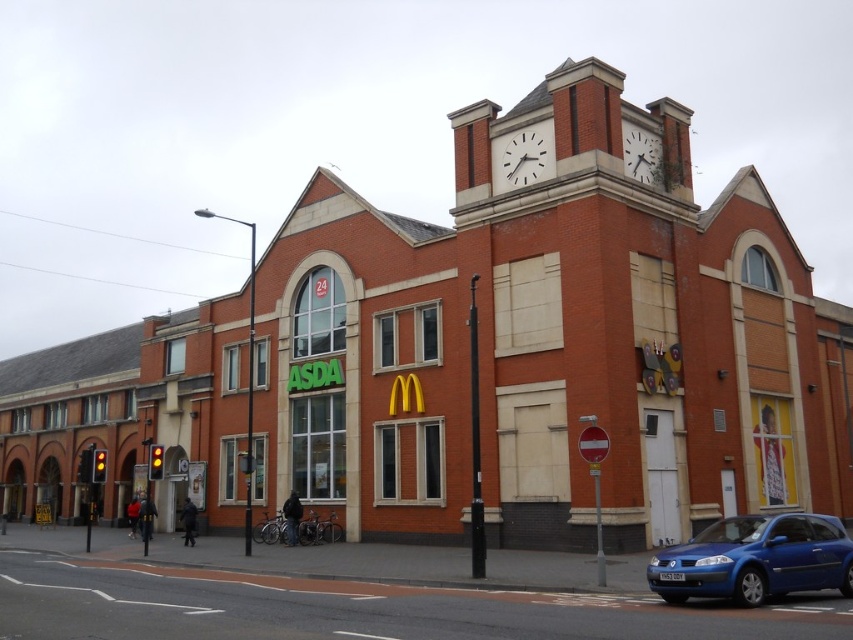
Measure the distance between point (503, 150) and camera.

Point (503, 150) is 53.59 meters away from camera.

Which is in front, point (503, 173) or point (631, 156)?

Positioned in front is point (631, 156).

Locate an element on the screen. white metallic clock at upper center is located at coordinates (524, 157).

Is blue metallic car at lower right closer to the viewer compared to white metallic clock at upper center?

Yes, it is in front of white metallic clock at upper center.

Is blue metallic car at lower right above white metallic clock at upper center?

Incorrect, blue metallic car at lower right is not positioned above white metallic clock at upper center.

Which is behind, point (672, 573) or point (544, 148)?

The point (544, 148) is behind.

You are a GUI agent. You are given a task and a screenshot of the screen. Output one action in this format:
    pyautogui.click(x=<x>, y=<y>)
    Task: Click on the blue metallic car at lower right
    
    Given the screenshot: What is the action you would take?
    pyautogui.click(x=755, y=560)

Is blue metallic car at lower right shorter than white clock face at upper center?

Incorrect, blue metallic car at lower right's height does not fall short of white clock face at upper center's.

Does blue metallic car at lower right have a smaller size compared to white clock face at upper center?

Actually, blue metallic car at lower right might be larger than white clock face at upper center.

This screenshot has width=853, height=640. What are the coordinates of `blue metallic car at lower right` in the screenshot? It's located at (755, 560).